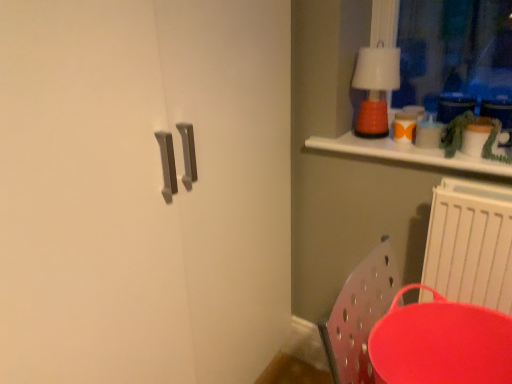
Question: Considering the relative sizes of orange matte lamp at upper right and white plastic radiator at lower right in the image provided, is orange matte lamp at upper right wider than white plastic radiator at lower right?

Choices:
 (A) no
 (B) yes

Answer: (B)

Question: From the image's perspective, is orange matte lamp at upper right above white plastic radiator at lower right?

Choices:
 (A) no
 (B) yes

Answer: (B)

Question: From the image's perspective, does orange matte lamp at upper right appear lower than white plastic radiator at lower right?

Choices:
 (A) no
 (B) yes

Answer: (A)

Question: Is white plastic radiator at lower right completely or partially inside orange matte lamp at upper right?

Choices:
 (A) yes
 (B) no

Answer: (B)

Question: Does orange matte lamp at upper right have a smaller size compared to white plastic radiator at lower right?

Choices:
 (A) yes
 (B) no

Answer: (A)

Question: Which is correct: matte red tray at lower right is inside white plastic radiator at lower right, or outside of it?

Choices:
 (A) inside
 (B) outside

Answer: (B)

Question: Considering the positions of matte red tray at lower right and white plastic radiator at lower right in the image, is matte red tray at lower right taller or shorter than white plastic radiator at lower right?

Choices:
 (A) tall
 (B) short

Answer: (B)

Question: Is matte red tray at lower right in front of or behind white plastic radiator at lower right in the image?

Choices:
 (A) front
 (B) behind

Answer: (A)

Question: From a real-world perspective, relative to white plastic radiator at lower right, is matte red tray at lower right vertically above or below?

Choices:
 (A) above
 (B) below

Answer: (B)

Question: Considering the positions of point (386, 352) and point (364, 99), is point (386, 352) closer or farther from the camera than point (364, 99)?

Choices:
 (A) closer
 (B) farther

Answer: (A)

Question: Do you think matte red tray at lower right is within orange matte lamp at upper right, or outside of it?

Choices:
 (A) outside
 (B) inside

Answer: (A)

Question: From the image's perspective, relative to orange matte lamp at upper right, is matte red tray at lower right above or below?

Choices:
 (A) above
 (B) below

Answer: (B)

Question: Is matte red tray at lower right in front of or behind orange matte lamp at upper right in the image?

Choices:
 (A) behind
 (B) front

Answer: (B)

Question: From a real-world perspective, is white plastic radiator at lower right above or below orange matte lamp at upper right?

Choices:
 (A) above
 (B) below

Answer: (B)

Question: In the image, is white plastic radiator at lower right positioned in front of or behind orange matte lamp at upper right?

Choices:
 (A) behind
 (B) front

Answer: (B)